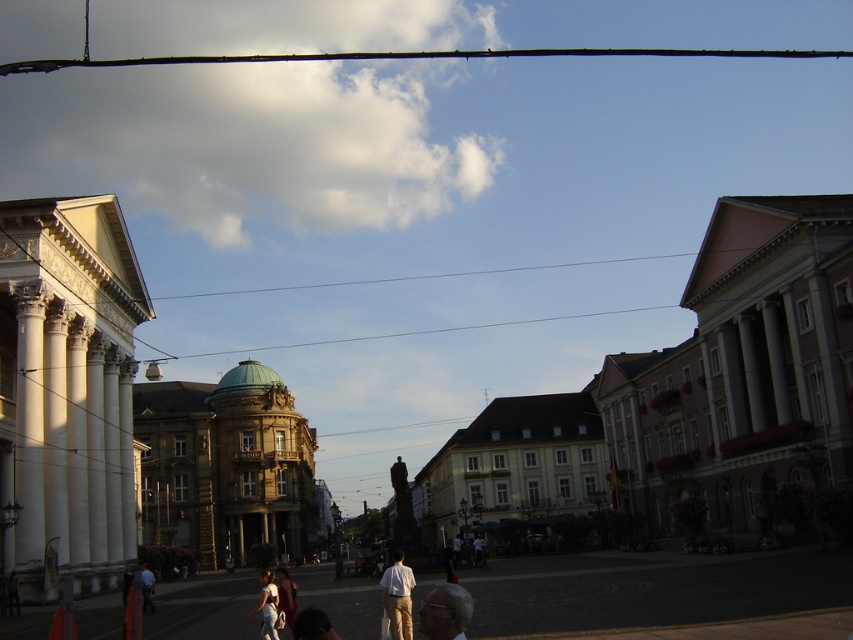
You are a photographer positioned at the end of the street, aiming to capture a photo of the gray fabric head at lower center and the white matte shirt at center. Which object will appear closer to the camera in the final photo?

The gray fabric head at lower center will appear closer to the camera in the final photo because it is positioned in front of the white matte shirt at center.